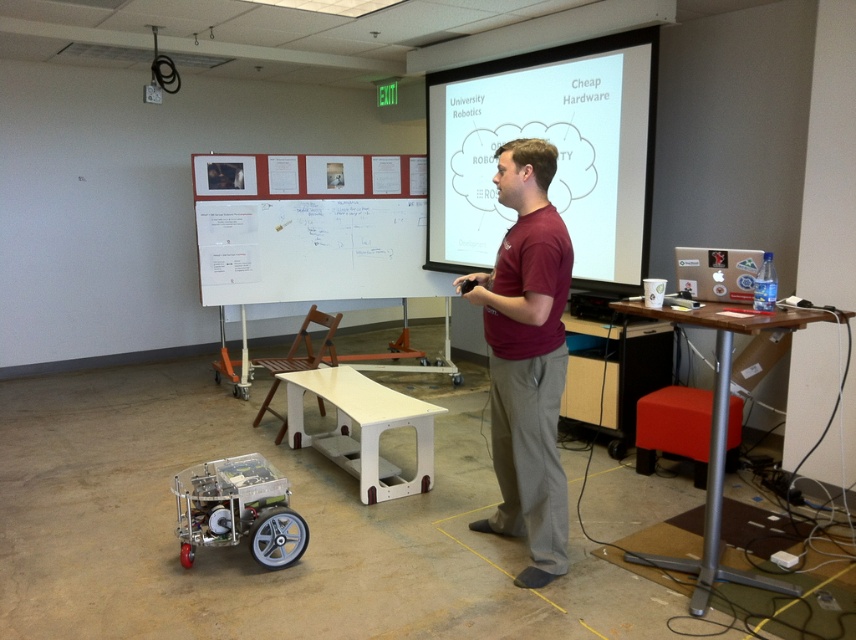
You are a guest attending the presentation and need to sit down. There is a red fabric stool at lower right and a metallic transparent robot at lower left. Which object is closer to you if you are standing in front of the screen?

The metallic transparent robot at lower left is closer to you because it is positioned under the red fabric stool at lower right, meaning it is located in front of the stool.